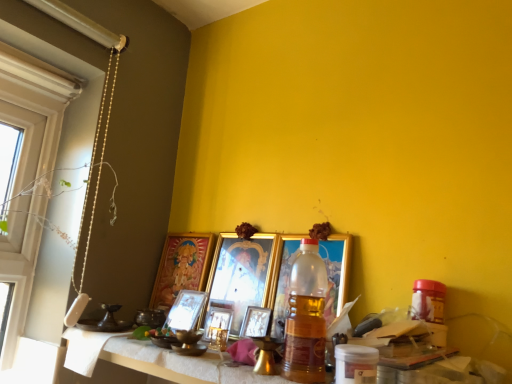
Question: Is metallic gold picture frame at center, the 2th picture frame when ordered from right to left, not close to gold metallic picture frame at center, marked as the 6th picture frame in a left-to-right arrangement?

Choices:
 (A) no
 (B) yes

Answer: (A)

Question: From the image's perspective, is metallic gold picture frame at center, the 2th picture frame when ordered from right to left, beneath gold metallic picture frame at center, marked as the 6th picture frame in a left-to-right arrangement?

Choices:
 (A) yes
 (B) no

Answer: (A)

Question: Does metallic gold picture frame at center, the 2th picture frame when ordered from right to left, appear on the left side of gold metallic picture frame at center, placed as the first picture frame when sorted from right to left?

Choices:
 (A) yes
 (B) no

Answer: (A)

Question: Can you confirm if metallic gold picture frame at center, arranged as the 5th picture frame when viewed from the left, is positioned to the right of gold metallic picture frame at center, placed as the first picture frame when sorted from right to left?

Choices:
 (A) yes
 (B) no

Answer: (B)

Question: Does metallic gold picture frame at center, arranged as the 5th picture frame when viewed from the left, have a lesser width compared to gold metallic picture frame at center, placed as the first picture frame when sorted from right to left?

Choices:
 (A) yes
 (B) no

Answer: (A)

Question: Is metallic gold picture frame at center, the 2th picture frame when ordered from right to left, smaller than gold metallic picture frame at center, placed as the first picture frame when sorted from right to left?

Choices:
 (A) no
 (B) yes

Answer: (B)

Question: Is white matte window at left thinner than white textured table at lower center?

Choices:
 (A) no
 (B) yes

Answer: (A)

Question: From the image's perspective, does white matte window at left appear higher than white textured table at lower center?

Choices:
 (A) yes
 (B) no

Answer: (A)

Question: Is white matte window at left shorter than white textured table at lower center?

Choices:
 (A) yes
 (B) no

Answer: (B)

Question: Is white matte window at left not within white textured table at lower center?

Choices:
 (A) no
 (B) yes

Answer: (B)

Question: Is white matte window at left taller than white textured table at lower center?

Choices:
 (A) no
 (B) yes

Answer: (B)

Question: Can you confirm if white matte window at left is positioned to the left of white textured table at lower center?

Choices:
 (A) no
 (B) yes

Answer: (B)

Question: Considering the relative sizes of white textured table at lower center and gold metallic picture frame at center, which appears as the fourth picture frame when viewed from the left, in the image provided, is white textured table at lower center bigger than gold metallic picture frame at center, which appears as the fourth picture frame when viewed from the left,?

Choices:
 (A) no
 (B) yes

Answer: (B)